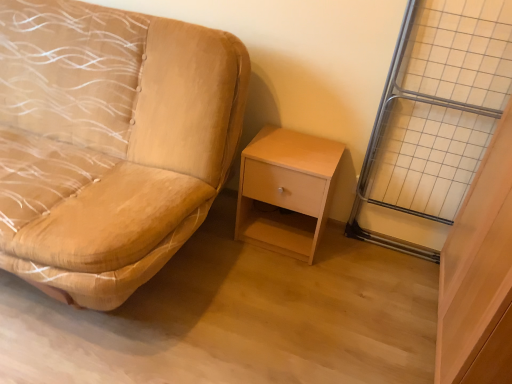
Locate an element on the screen. This screenshot has width=512, height=384. vacant area that lies in front of metal grid at right is located at coordinates (393, 285).